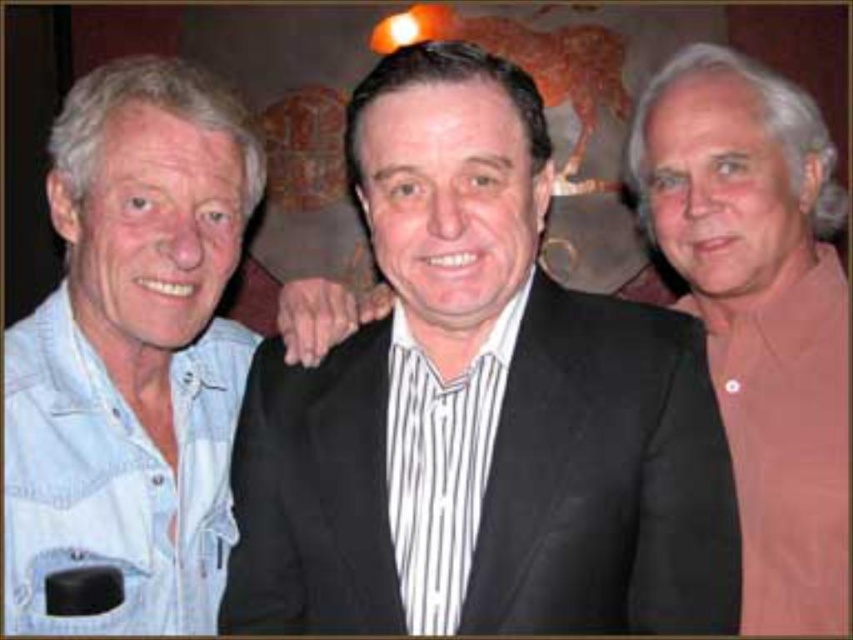
You are a photographer at a social event. You need to capture a photo of the black striped shirt at center and the pink matte shirt at right. Which of the two shirts should you focus on first if you want to ensure both are in frame without moving the camera?

The black striped shirt at center has a smaller size compared to pink matte shirt at right, so you should focus on the smaller black striped shirt at center first to ensure it is fully in frame before the larger pink matte shirt at right.

You are a photographer trying to capture a clear photo of the black striped shirt at center. The camera you are using has a minimum focusing distance of 36 inches. Will you be able to take a clear photo without moving closer?

The distance between the black striped shirt at center and the camera is 36.13 inches, which is slightly beyond the camera minimum focusing distance of 36 inches. Therefore, you will not be able to take a clear photo without moving closer.

Based on the scene description, which object is positioned lower in the image? The black striped shirt at center or the pink matte shirt at right?

The black striped shirt at center is located below the pink matte shirt at right, so the black striped shirt at center is positioned lower in the image.